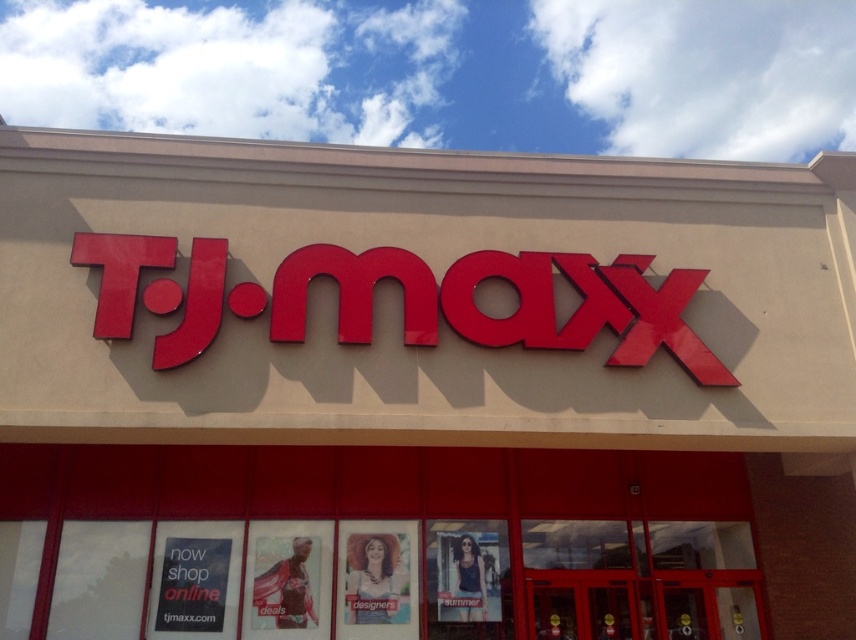
Question: Which of the following is the closest to the observer?

Choices:
 (A) black paper sign at lower left
 (B) glossy red sign at center

Answer: (B)

Question: Does glossy red sign at center appear over black paper sign at lower left?

Choices:
 (A) yes
 (B) no

Answer: (A)

Question: In this image, where is glossy red sign at center located relative to black paper sign at lower left?

Choices:
 (A) right
 (B) left

Answer: (A)

Question: Considering the relative positions of glossy red sign at center and black paper sign at lower left in the image provided, where is glossy red sign at center located with respect to black paper sign at lower left?

Choices:
 (A) left
 (B) right

Answer: (B)